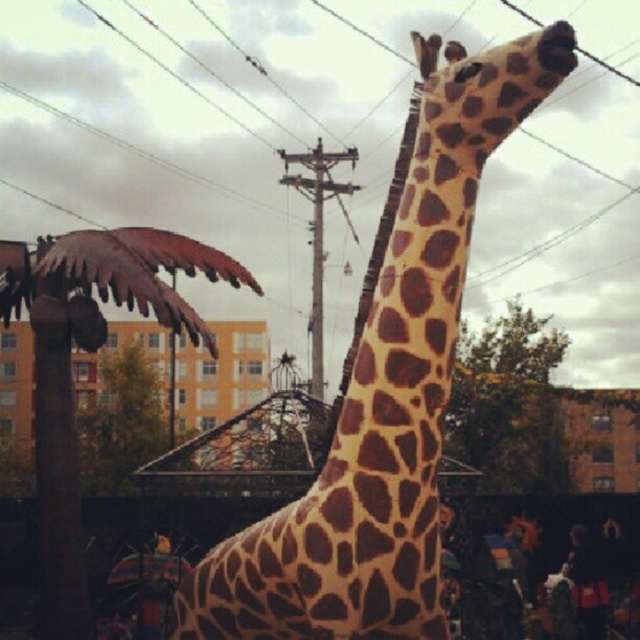
From the picture: Is spotted fabric giraffe at center further to the viewer compared to metallic brown palm tree at left?

No, spotted fabric giraffe at center is in front of metallic brown palm tree at left.

Who is taller, spotted fabric giraffe at center or metallic brown palm tree at left?

spotted fabric giraffe at center is taller.

The height and width of the screenshot is (640, 640). Describe the element at coordinates (385, 392) in the screenshot. I see `spotted fabric giraffe at center` at that location.

The width and height of the screenshot is (640, 640). I want to click on spotted fabric giraffe at center, so click(x=385, y=392).

Is point (410, 276) positioned behind point (522, 412)?

No, (410, 276) is closer to viewer.

Can you confirm if spotted fabric giraffe at center is wider than green leafy tree at upper right?

No, spotted fabric giraffe at center is not wider than green leafy tree at upper right.

Find the location of `spotted fabric giraffe at center`. spotted fabric giraffe at center is located at coordinates (385, 392).

Where is `spotted fabric giraffe at center`? spotted fabric giraffe at center is located at coordinates (385, 392).

Describe the element at coordinates (88, 352) in the screenshot. I see `metallic brown palm tree at left` at that location.

Between point (193, 323) and point (500, 458), which one is positioned behind?

Point (500, 458)

Who is more distant from viewer, (80,291) or (481,332)?

Positioned behind is point (481,332).

You are a GUI agent. You are given a task and a screenshot of the screen. Output one action in this format:
    pyautogui.click(x=<x>, y=<y>)
    Task: Click on the metallic brown palm tree at left
    
    Given the screenshot: What is the action you would take?
    pyautogui.click(x=88, y=352)